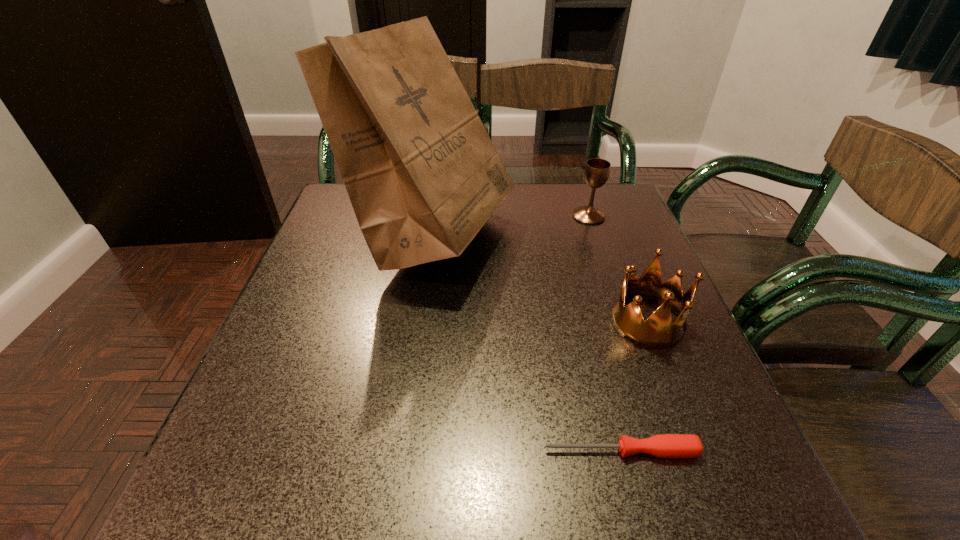
Identify the location of grocery bag. (423, 176).

Find the location of a particular element. This screenshot has height=540, width=960. the tallest object is located at coordinates (x=423, y=176).

I want to click on chalice, so click(597, 170).

At what (x,y) coordinates should I click in order to perform the action: click on crown. Please return your answer as a coordinate pair (x, y). Looking at the image, I should click on (658, 331).

What are the coordinates of `the nearest object` in the screenshot? It's located at (664, 445).

Image resolution: width=960 pixels, height=540 pixels. Find the location of `screwdriver`. screwdriver is located at coordinates (664, 445).

Identify the location of vacant space located 0.400m on the front of the tallest object. (399, 499).

At what (x,y) coordinates should I click in order to perform the action: click on vacant space located 0.150m on the front of the chalice. Please return your answer as a coordinate pair (x, y). The width and height of the screenshot is (960, 540). Looking at the image, I should click on (604, 262).

Locate an element on the screen. free space located on the back of the crown is located at coordinates (599, 198).

The height and width of the screenshot is (540, 960). What are the coordinates of `free space located 0.150m at the tip of the shortest object` in the screenshot? It's located at click(x=447, y=451).